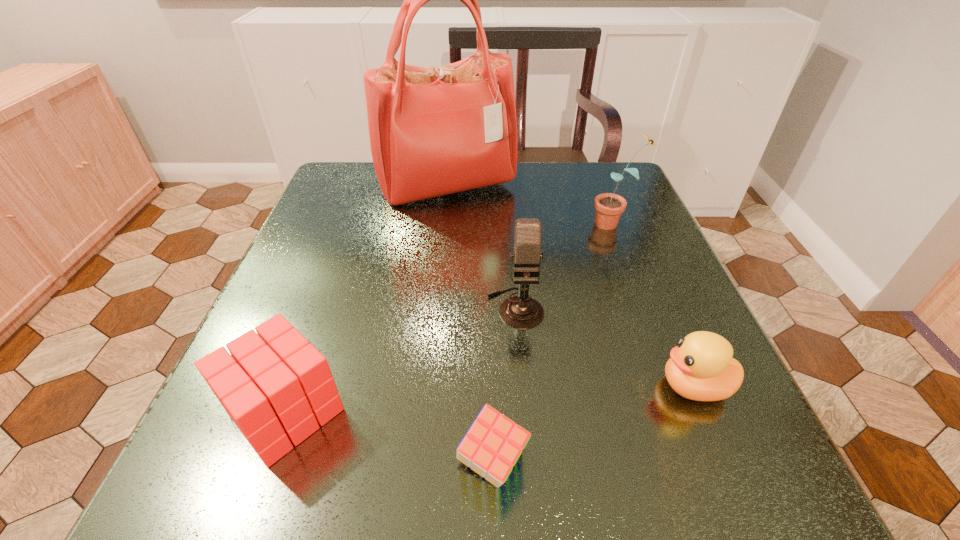
Where is `free area in between the sunflower and the shorter cube`? Image resolution: width=960 pixels, height=540 pixels. free area in between the sunflower and the shorter cube is located at coordinates (553, 343).

Where is `object that stands as the fifth closest to the duckling`? This screenshot has width=960, height=540. object that stands as the fifth closest to the duckling is located at coordinates (275, 386).

This screenshot has height=540, width=960. Find the location of `the fifth closest object to the right cube`. the fifth closest object to the right cube is located at coordinates (433, 131).

The image size is (960, 540). What are the coordinates of `vacant space that satisfies the following two spatial constraints: 1. on the flower of the sunflower; 2. on the front-facing side of the third farthest object` in the screenshot? It's located at (647, 307).

Find the location of a particular element. This screenshot has height=540, width=960. free space that satisfies the following two spatial constraints: 1. on the face of the duckling; 2. on the front side of the right cube is located at coordinates (727, 463).